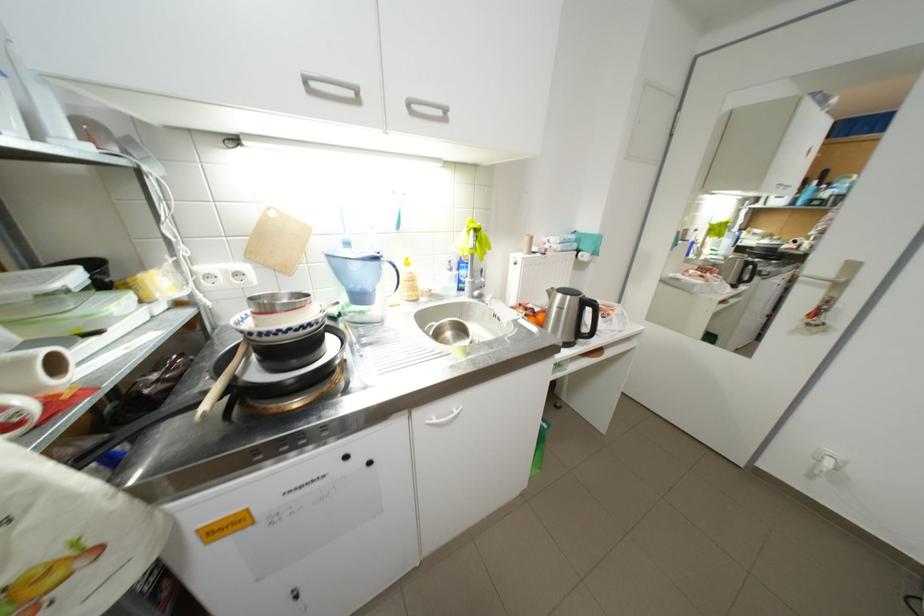
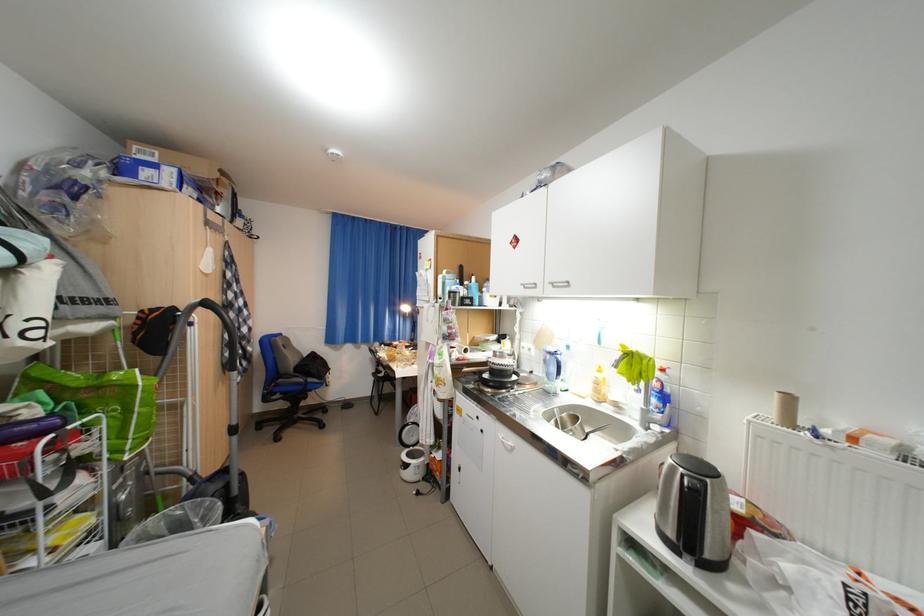
In the second image, find the point that corresponds to point 420,105 in the first image.

(564, 285)